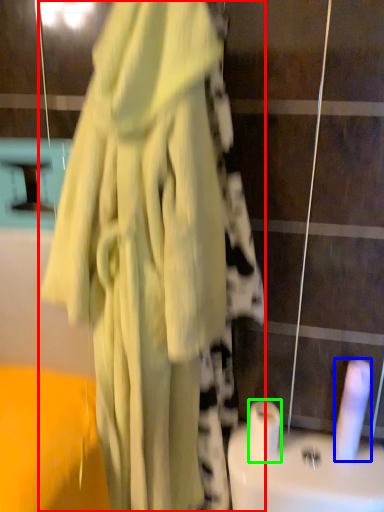
Question: Based on their relative distances, which object is nearer to fancy dress (highlighted by a red box)? Choose from toilet paper (highlighted by a blue box) and toilet paper (highlighted by a green box).

Choices:
 (A) toilet paper
 (B) toilet paper

Answer: (B)